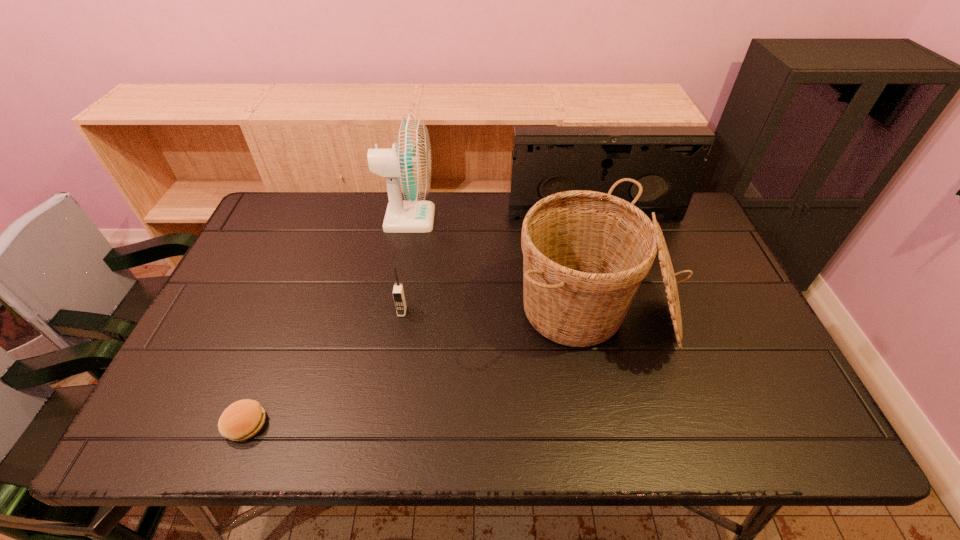
This screenshot has height=540, width=960. I want to click on free spot that satisfies the following two spatial constraints: 1. in front of the fan to face the airflow; 2. on the right side of the basket, so click(x=392, y=312).